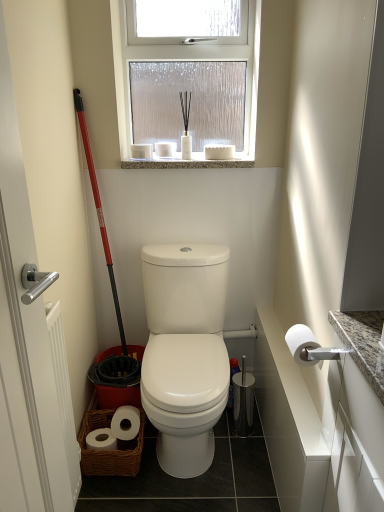
Question: Is frosted glass window at upper center outside white glossy toilet at center?

Choices:
 (A) yes
 (B) no

Answer: (A)

Question: Are frosted glass window at upper center and white glossy toilet at center beside each other?

Choices:
 (A) yes
 (B) no

Answer: (B)

Question: Is white glossy toilet at center located within frosted glass window at upper center?

Choices:
 (A) no
 (B) yes

Answer: (A)

Question: Does frosted glass window at upper center have a lesser height compared to white glossy toilet at center?

Choices:
 (A) yes
 (B) no

Answer: (B)

Question: From a real-world perspective, is frosted glass window at upper center physically above white glossy toilet at center?

Choices:
 (A) yes
 (B) no

Answer: (A)

Question: Does frosted glass window at upper center have a larger size compared to white glossy toilet at center?

Choices:
 (A) no
 (B) yes

Answer: (A)

Question: Is white matte toilet paper at right closer to camera compared to white glossy toilet at center?

Choices:
 (A) no
 (B) yes

Answer: (B)

Question: From the image's perspective, is white matte toilet paper at right below white glossy toilet at center?

Choices:
 (A) no
 (B) yes

Answer: (A)

Question: Does white matte toilet paper at right have a larger size compared to white glossy toilet at center?

Choices:
 (A) no
 (B) yes

Answer: (A)

Question: Does white matte toilet paper at right turn towards white glossy toilet at center?

Choices:
 (A) no
 (B) yes

Answer: (A)

Question: Can you confirm if white matte toilet paper at right is thinner than white glossy toilet at center?

Choices:
 (A) yes
 (B) no

Answer: (A)

Question: Is white matte toilet paper at right surrounding white glossy toilet at center?

Choices:
 (A) yes
 (B) no

Answer: (B)

Question: From a real-world perspective, is white glossy toilet at center physically above white matte toilet paper at right?

Choices:
 (A) no
 (B) yes

Answer: (A)